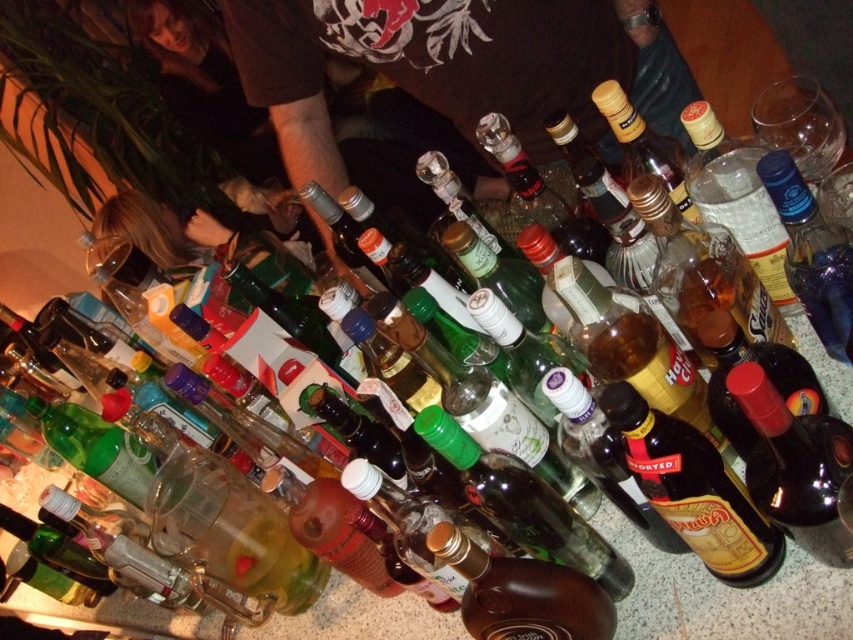
Question: Can you confirm if black t-shirt at center is positioned to the left of brown glass bottle at center?

Choices:
 (A) no
 (B) yes

Answer: (A)

Question: Among these points, which one is farthest from the camera?

Choices:
 (A) (479, 609)
 (B) (763, 397)
 (C) (281, 58)
 (D) (755, 580)

Answer: (C)

Question: Does shiny dark red bottle at center come behind brown glass bottle at center?

Choices:
 (A) no
 (B) yes

Answer: (A)

Question: Is shiny dark red bottle at center below brown glass bottle at center?

Choices:
 (A) yes
 (B) no

Answer: (B)

Question: Estimate the real-world distances between objects in this image. Which object is farther from the brown glass bottle at center?

Choices:
 (A) shiny dark red bottle at center
 (B) black t-shirt at center

Answer: (B)

Question: Which of these objects is positioned farthest from the shiny dark red bottle at center?

Choices:
 (A) black t-shirt at center
 (B) brown glass bottle at center
 (C) amber glass bottle at center

Answer: (A)